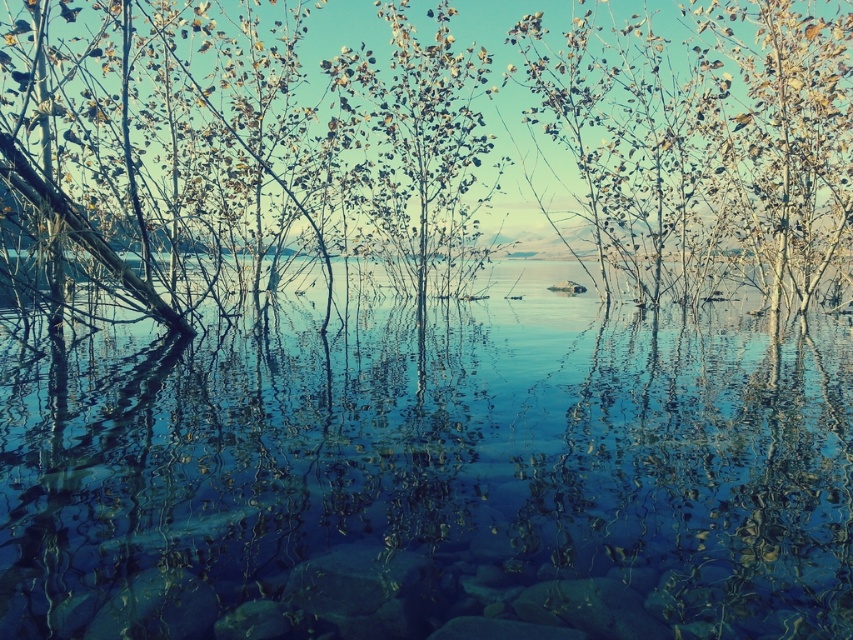
Question: Which point is farther to the camera?

Choices:
 (A) clear glass water at center
 (B) green leafy tree at center

Answer: (B)

Question: Is clear glass water at center thinner than green leafy tree at center?

Choices:
 (A) no
 (B) yes

Answer: (B)

Question: Does clear glass water at center have a larger size compared to green leafy tree at center?

Choices:
 (A) yes
 (B) no

Answer: (B)

Question: Does clear glass water at center appear under green leafy tree at center?

Choices:
 (A) yes
 (B) no

Answer: (A)